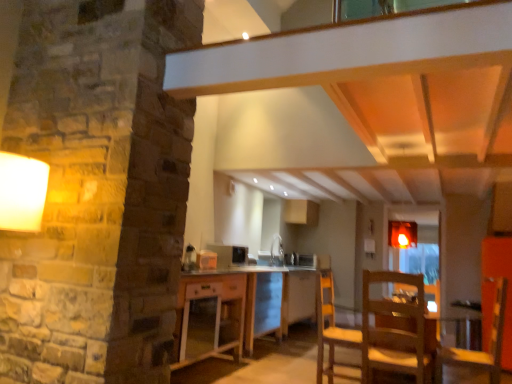
Question: Considering the relative sizes of transparent glass door at center and satin black microwave at center, which appears as the first appliance when viewed from the left, in the image provided, is transparent glass door at center shorter than satin black microwave at center, which appears as the first appliance when viewed from the left,?

Choices:
 (A) no
 (B) yes

Answer: (A)

Question: Is transparent glass door at center turned away from satin black microwave at center, marked as the 1th appliance in a front-to-back arrangement?

Choices:
 (A) yes
 (B) no

Answer: (B)

Question: Is transparent glass door at center outside of satin black microwave at center, arranged as the second appliance when ordered from the bottom?

Choices:
 (A) no
 (B) yes

Answer: (B)

Question: From the image's perspective, is transparent glass door at center on satin black microwave at center, marked as the 1th appliance in a front-to-back arrangement?

Choices:
 (A) yes
 (B) no

Answer: (B)

Question: Is transparent glass door at center facing towards satin black microwave at center, which appears as the first appliance when viewed from the left?

Choices:
 (A) yes
 (B) no

Answer: (B)

Question: From a real-world perspective, is white glossy microwave at center, which is the 1th appliance from back to front, positioned above or below wooden chair at lower right, the 1th chair from the left?

Choices:
 (A) above
 (B) below

Answer: (A)

Question: In terms of height, does white glossy microwave at center, placed as the 1th appliance when sorted from right to left, look taller or shorter compared to wooden chair at lower right, the 1th chair from the left?

Choices:
 (A) tall
 (B) short

Answer: (B)

Question: Based on their positions, is white glossy microwave at center, placed as the 1th appliance when sorted from right to left, located to the left or right of wooden chair at lower right, which appears as the second chair when viewed from the right?

Choices:
 (A) right
 (B) left

Answer: (A)

Question: Which is correct: white glossy microwave at center, which ranks as the 1th appliance in bottom-to-top order, is inside wooden chair at lower right, which appears as the second chair when viewed from the right, or outside of it?

Choices:
 (A) inside
 (B) outside

Answer: (B)

Question: Which is correct: wooden table at center is inside white glossy microwave at center, which ranks as the 1th appliance in bottom-to-top order, or outside of it?

Choices:
 (A) inside
 (B) outside

Answer: (B)

Question: From a real-world perspective, is wooden table at center above or below white glossy microwave at center, positioned as the second appliance in top-to-bottom order?

Choices:
 (A) below
 (B) above

Answer: (A)

Question: Based on their positions, is wooden table at center located to the left or right of white glossy microwave at center, placed as the 2th appliance when sorted from left to right?

Choices:
 (A) left
 (B) right

Answer: (A)

Question: Considering the positions of point (252, 311) and point (305, 256), is point (252, 311) closer or farther from the camera than point (305, 256)?

Choices:
 (A) closer
 (B) farther

Answer: (A)

Question: Is satin black microwave at center, which appears as the 2th appliance when viewed from the back, taller or shorter than wooden chair at lower right, which appears as the second chair when viewed from the right?

Choices:
 (A) short
 (B) tall

Answer: (A)

Question: In terms of size, does satin black microwave at center, which appears as the 2th appliance when viewed from the back, appear bigger or smaller than wooden chair at lower right, which appears as the second chair when viewed from the right?

Choices:
 (A) small
 (B) big

Answer: (A)